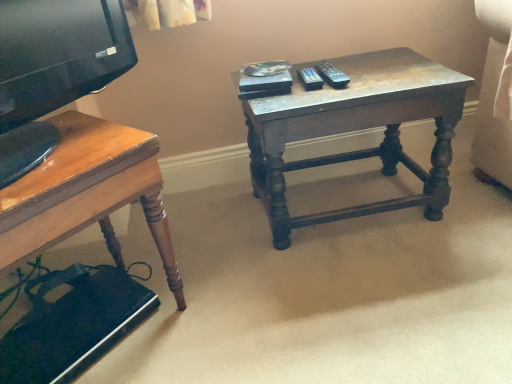
The height and width of the screenshot is (384, 512). Describe the element at coordinates (356, 130) in the screenshot. I see `distressed wood table at center` at that location.

What is the approximate width of distressed wood table at center?

The width of distressed wood table at center is 14.29 inches.

Where is `distressed wood table at center`? distressed wood table at center is located at coordinates (356, 130).

In order to face distressed wood table at center, should I rotate leftwards or rightwards?

You should look right and rotate roughly 11.521 degrees.

Describe the element at coordinates (86, 193) in the screenshot. I see `wooden desk at lower left` at that location.

Image resolution: width=512 pixels, height=384 pixels. I want to click on wooden desk at lower left, so tap(86, 193).

What is the approximate height of wooden desk at lower left?

45.87 centimeters.

Where is `distressed wood table at center`? This screenshot has height=384, width=512. distressed wood table at center is located at coordinates (356, 130).

Visually, is distressed wood table at center positioned to the left or to the right of wooden desk at lower left?

From the image, it's evident that distressed wood table at center is to the right of wooden desk at lower left.

Between distressed wood table at center and wooden desk at lower left, which one is positioned in front?

wooden desk at lower left is more forward.

Is point (280, 240) in front of point (71, 221)?

No, it is not.

From the image's perspective, is distressed wood table at center located above or below wooden desk at lower left?

From the image's perspective, distressed wood table at center appears above wooden desk at lower left.

From a real-world perspective, between distressed wood table at center and wooden desk at lower left, who is vertically lower?

distressed wood table at center is physically lower.

Considering the relative sizes of distressed wood table at center and wooden desk at lower left in the image provided, is distressed wood table at center thinner than wooden desk at lower left?

Correct, the width of distressed wood table at center is less than that of wooden desk at lower left.

From the picture: From their relative heights in the image, would you say distressed wood table at center is taller or shorter than wooden desk at lower left?

Considering their sizes, distressed wood table at center has less height than wooden desk at lower left.

Which of these two, distressed wood table at center or wooden desk at lower left, is bigger?

Bigger between the two is distressed wood table at center.

Is distressed wood table at center completely or partially outside of wooden desk at lower left?

Yes, distressed wood table at center is outside of wooden desk at lower left.

Can you see distressed wood table at center touching wooden desk at lower left?

They are not placed beside each other.

In the scene shown: Is distressed wood table at center looking in the opposite direction of wooden desk at lower left?

No, wooden desk at lower left is not at the back of distressed wood table at center.

Can you tell me how much distressed wood table at center and wooden desk at lower left differ in facing direction?

40.3 degrees.

How far apart are distressed wood table at center and wooden desk at lower left?

distressed wood table at center is 49.00 centimeters away from wooden desk at lower left.

Where is `table that appears behind the wooden desk at lower left`? The width and height of the screenshot is (512, 384). table that appears behind the wooden desk at lower left is located at coordinates (356, 130).

Visually, is wooden desk at lower left positioned to the left or to the right of distressed wood table at center?

In the image, wooden desk at lower left appears on the left side of distressed wood table at center.

Is wooden desk at lower left closer to the viewer compared to distressed wood table at center?

Yes, it is.

Which is nearer, (65, 221) or (260, 184)?

Point (65, 221)

From the image's perspective, is wooden desk at lower left beneath distressed wood table at center?

Correct, wooden desk at lower left appears lower than distressed wood table at center in the image.

From a real-world perspective, who is located higher, wooden desk at lower left or distressed wood table at center?

In real-world perspective, wooden desk at lower left is above.

Considering the relative sizes of wooden desk at lower left and distressed wood table at center in the image provided, is wooden desk at lower left thinner than distressed wood table at center?

No, wooden desk at lower left is not thinner than distressed wood table at center.

Who is taller, wooden desk at lower left or distressed wood table at center?

wooden desk at lower left is taller.

Is wooden desk at lower left bigger than distressed wood table at center?

No.

From the picture: Do you think wooden desk at lower left is within distressed wood table at center, or outside of it?

wooden desk at lower left is not enclosed by distressed wood table at center.

Would you consider wooden desk at lower left to be distant from distressed wood table at center?

wooden desk at lower left is actually quite close to distressed wood table at center.

Is wooden desk at lower left facing towards distressed wood table at center?

No, wooden desk at lower left is not oriented towards distressed wood table at center.

How far apart are wooden desk at lower left and distressed wood table at center?

wooden desk at lower left is 19.29 inches away from distressed wood table at center.

Where is `desk in front of the distressed wood table at center`? desk in front of the distressed wood table at center is located at coordinates (86, 193).

Where is `table located on the right of wooden desk at lower left`? The height and width of the screenshot is (384, 512). table located on the right of wooden desk at lower left is located at coordinates click(x=356, y=130).

Identify the location of desk that appears on the left of distressed wood table at center. (86, 193).